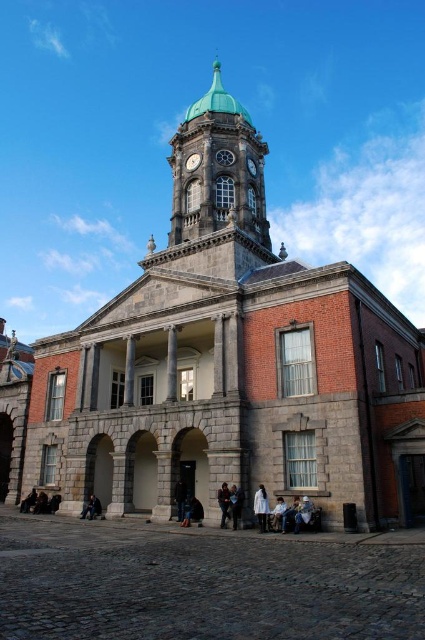
Question: Which object is closer to the camera taking this photo?

Choices:
 (A) dark gray stone person at lower left
 (B) dark brown leather jacket at center
 (C) light brown leather jacket at lower center

Answer: (C)

Question: Does white fabric at lower center have a smaller size compared to leather jacket at lower center?

Choices:
 (A) no
 (B) yes

Answer: (B)

Question: Can you confirm if green copper dome at upper center is bigger than light blue denim jacket at lower center?

Choices:
 (A) yes
 (B) no

Answer: (A)

Question: Which point is farther to the camera?

Choices:
 (A) green copper dome at upper center
 (B) light brown leather jacket at lower center

Answer: (A)

Question: Is light brown leather jacket at center wider than white fabric at lower center?

Choices:
 (A) yes
 (B) no

Answer: (B)

Question: Estimate the real-world distances between objects in this image. Which object is farther from the white cotton coat at center?

Choices:
 (A) green copper dome at upper center
 (B) light brown leather jacket at lower center

Answer: (A)